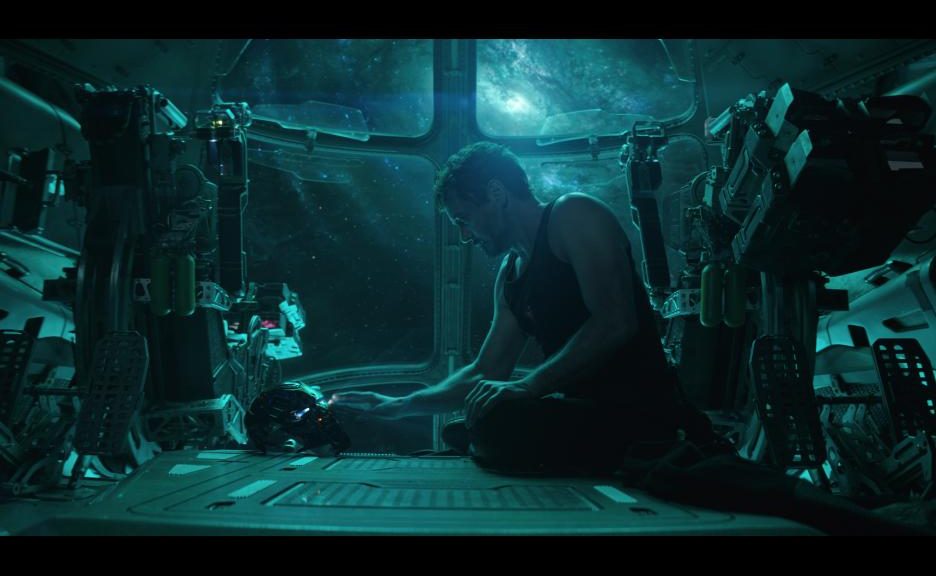
Find the location of a particular element. light is located at coordinates (514, 104).